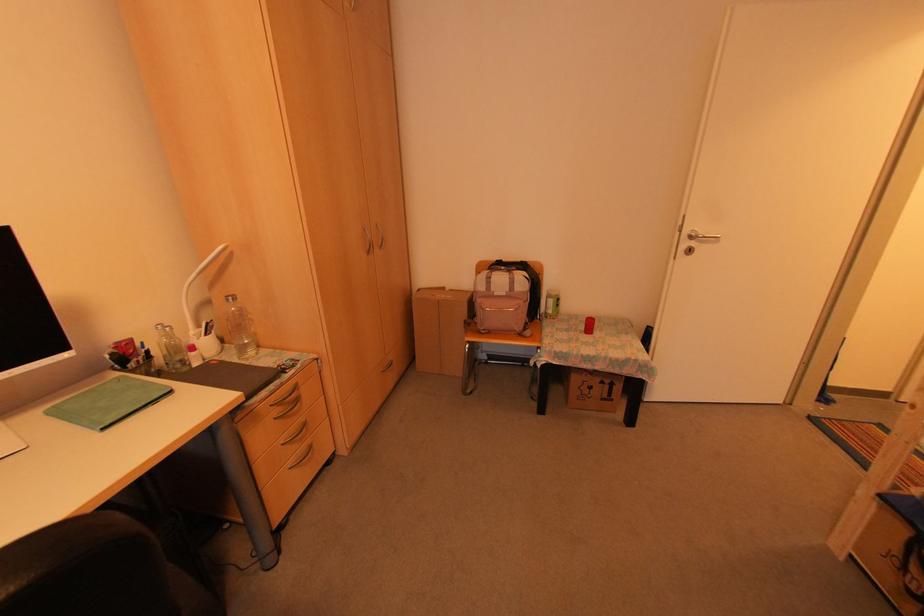
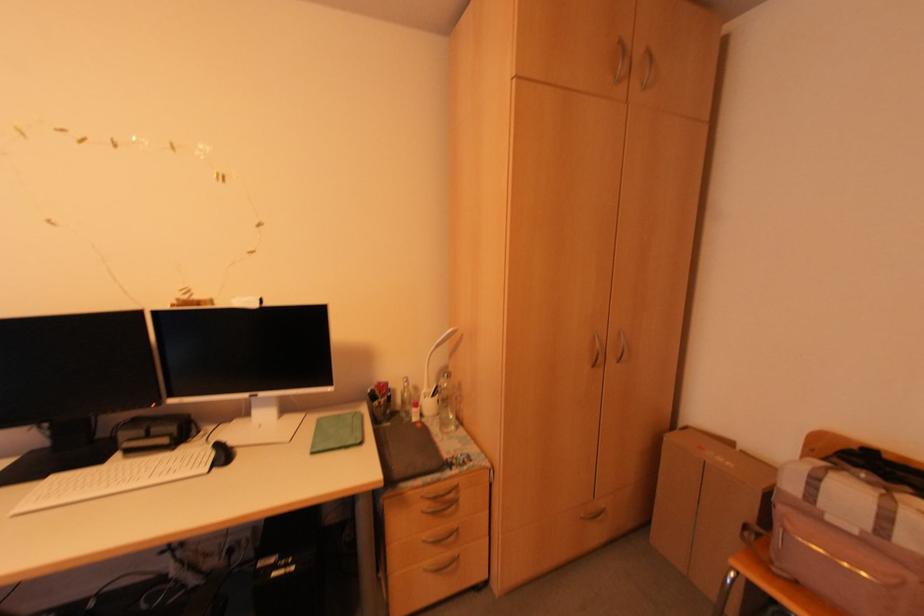
Find the pixel in the second image that matches pixel 204 333 in the first image.

(431, 395)